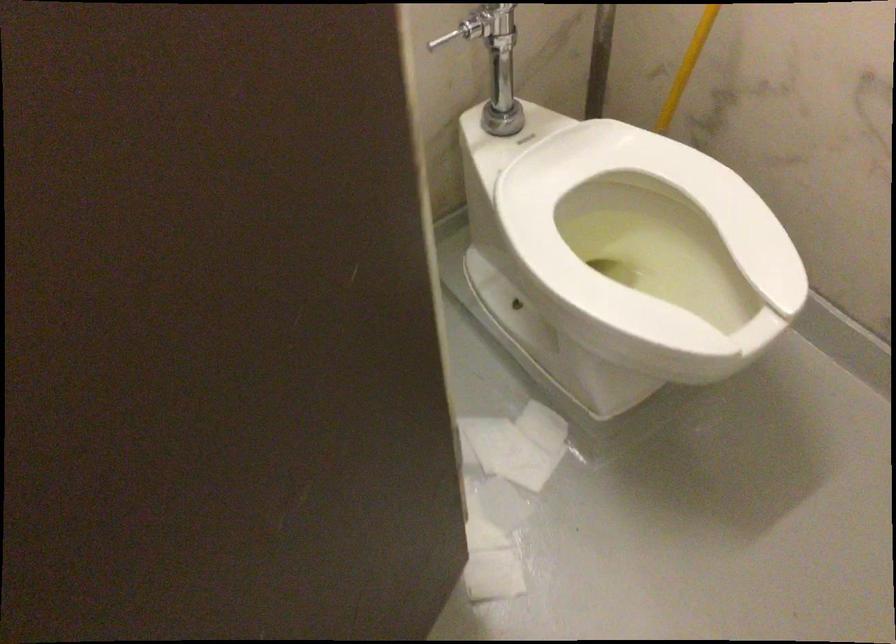
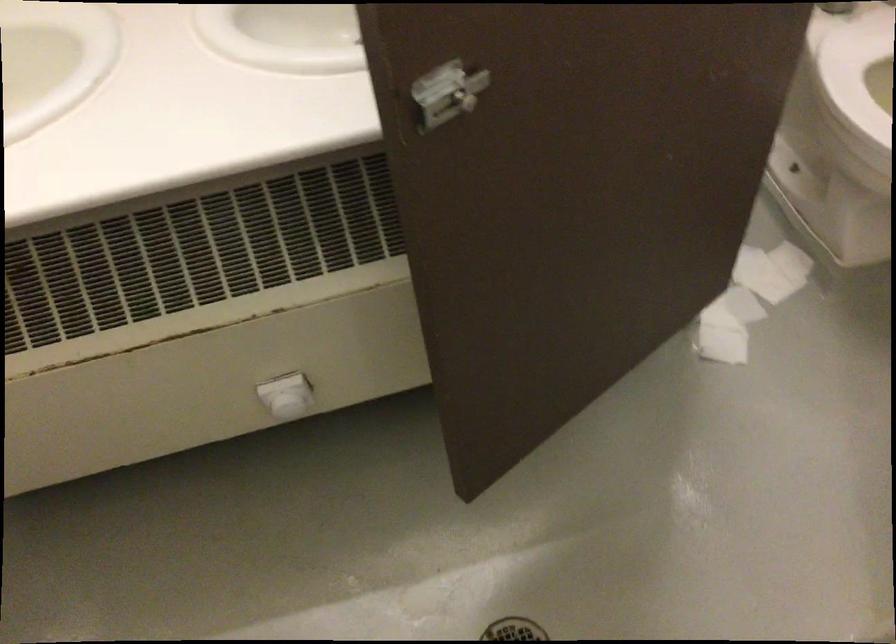
Where in the second image is the point corresponding to (509,513) from the first image?

(739, 305)